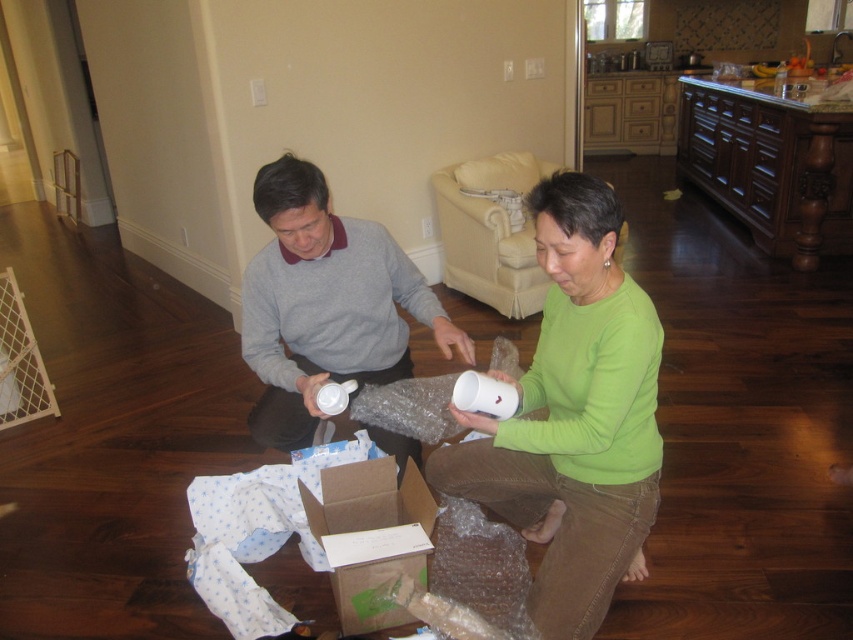
Is gray matte sweater at center positioned behind brown cardboard box at center?

Yes.

This screenshot has width=853, height=640. What do you see at coordinates (325, 304) in the screenshot? I see `gray matte sweater at center` at bounding box center [325, 304].

Is point (320, 177) in front of point (422, 541)?

That is False.

The width and height of the screenshot is (853, 640). Identify the location of gray matte sweater at center. (325, 304).

Locate an element on the screen. green matte/matte cup at center is located at coordinates (573, 419).

Based on the photo, does green matte/matte cup at center have a greater height compared to brown cardboard box at center?

Correct, green matte/matte cup at center is much taller as brown cardboard box at center.

Is point (639, 298) positioned after point (399, 556)?

That is False.

You are a GUI agent. You are given a task and a screenshot of the screen. Output one action in this format:
    pyautogui.click(x=<x>, y=<y>)
    Task: Click on the green matte/matte cup at center
    This screenshot has width=853, height=640.
    Given the screenshot: What is the action you would take?
    pyautogui.click(x=573, y=419)

Based on the photo, does green matte/matte cup at center come in front of gray matte sweater at center?

Yes.

Can you confirm if green matte/matte cup at center is positioned to the right of gray matte sweater at center?

Indeed, green matte/matte cup at center is positioned on the right side of gray matte sweater at center.

Who is more distant from viewer, (618, 508) or (314, 429)?

The point (314, 429) is more distant.

Where is `green matte/matte cup at center`? green matte/matte cup at center is located at coordinates (573, 419).